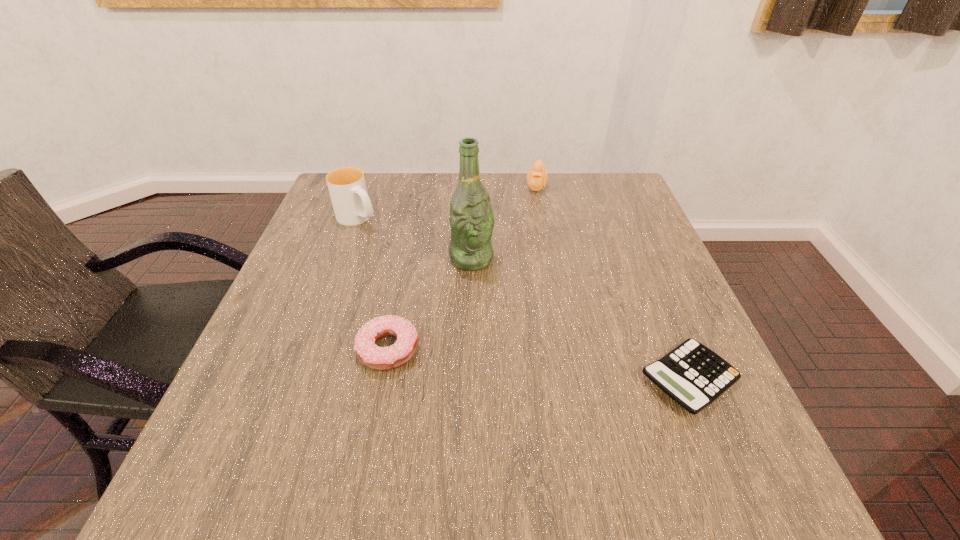
At what (x,y) coordinates should I click in order to perform the action: click on free region located 0.250m on the back of the fourth object from right to left. Please return your answer as a coordinate pair (x, y). Looking at the image, I should click on (408, 249).

Locate an element on the screen. The height and width of the screenshot is (540, 960). free spot located 0.120m on the back of the shortest object is located at coordinates (656, 300).

This screenshot has width=960, height=540. I want to click on vacant space situated 0.400m on the face of the second object from right to left, so click(x=523, y=291).

The width and height of the screenshot is (960, 540). I want to click on free space located on the face of the second object from right to left, so click(531, 235).

Identify the location of free space located on the face of the second object from right to left. (524, 285).

Where is `free space located 0.270m with the handle on the side of the fourth nearest object`? The image size is (960, 540). free space located 0.270m with the handle on the side of the fourth nearest object is located at coordinates [x=436, y=277].

Find the location of a particular element. This screenshot has height=540, width=960. vacant space located 0.330m with the handle on the side of the fourth nearest object is located at coordinates (454, 290).

The height and width of the screenshot is (540, 960). I want to click on free space located 0.400m with the handle on the side of the fourth nearest object, so click(x=475, y=306).

The width and height of the screenshot is (960, 540). Find the location of `vacant region located 0.270m on the surface of the third object from right to left`. vacant region located 0.270m on the surface of the third object from right to left is located at coordinates (557, 349).

Identify the location of free region located on the surface of the third object from right to left. (526, 316).